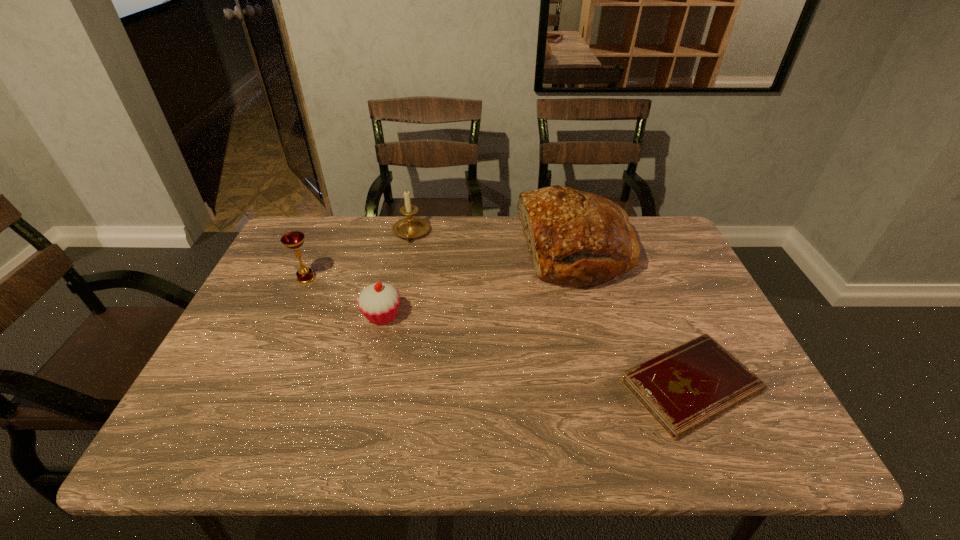
Identify the location of the tallest object. (576, 237).

The height and width of the screenshot is (540, 960). I want to click on candle holder, so [411, 227].

The height and width of the screenshot is (540, 960). I want to click on the leftmost object, so (x=294, y=240).

The height and width of the screenshot is (540, 960). What are the coordinates of `cupcake` in the screenshot? It's located at (378, 302).

Find the location of a particular element. The height and width of the screenshot is (540, 960). the fourth farthest object is located at coordinates (378, 302).

Where is `notebook`? The image size is (960, 540). notebook is located at coordinates (691, 384).

Locate an element on the screen. This screenshot has width=960, height=540. the shortest object is located at coordinates (691, 384).

Locate an element on the screen. The width and height of the screenshot is (960, 540). free location located at the sliced front of the tallest object is located at coordinates (434, 250).

This screenshot has height=540, width=960. I want to click on free spot located 0.160m at the sliced front of the tallest object, so click(x=467, y=250).

Locate an element on the screen. The width and height of the screenshot is (960, 540). vacant space positioned 0.380m at the sliced front of the tallest object is located at coordinates (395, 250).